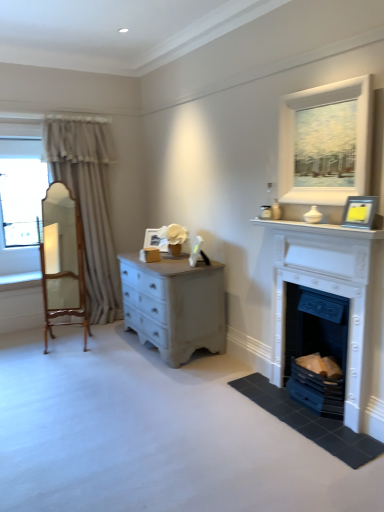
Question: Are matte white painting at upper right and white matte picture frame at center, which ranks as the 2th picture frame in right-to-left order, located far from each other?

Choices:
 (A) yes
 (B) no

Answer: (A)

Question: Can you see matte white painting at upper right touching white matte picture frame at center, which is the 1th picture frame from left to right?

Choices:
 (A) yes
 (B) no

Answer: (B)

Question: From the image's perspective, is matte white painting at upper right located beneath white matte picture frame at center, which is the 1th picture frame from left to right?

Choices:
 (A) no
 (B) yes

Answer: (A)

Question: Is matte white painting at upper right positioned with its back to white matte picture frame at center, which is the 1th picture frame from left to right?

Choices:
 (A) no
 (B) yes

Answer: (A)

Question: Considering the relative positions of matte white painting at upper right and white matte picture frame at center, which is the 1th picture frame from left to right, in the image provided, is matte white painting at upper right behind white matte picture frame at center, which is the 1th picture frame from left to right,?

Choices:
 (A) yes
 (B) no

Answer: (B)

Question: Is matte white painting at upper right closer to the viewer compared to white matte picture frame at center, which is the second picture frame from front to back?

Choices:
 (A) yes
 (B) no

Answer: (A)

Question: Is white matte picture frame at center, which ranks as the 2th picture frame in right-to-left order, taller than silver metallic picture frame at upper right, the second picture frame positioned from the back?

Choices:
 (A) yes
 (B) no

Answer: (A)

Question: From a real-world perspective, is white matte picture frame at center, which ranks as the 2th picture frame in right-to-left order, on top of silver metallic picture frame at upper right, arranged as the first picture frame when viewed from the right?

Choices:
 (A) no
 (B) yes

Answer: (A)

Question: Would you consider white matte picture frame at center, which ranks as the 2th picture frame in right-to-left order, to be distant from silver metallic picture frame at upper right, the second picture frame positioned from the back?

Choices:
 (A) no
 (B) yes

Answer: (B)

Question: Considering the relative positions of white matte picture frame at center, which is the 1th picture frame from left to right, and silver metallic picture frame at upper right, the second picture frame positioned from the back, in the image provided, is white matte picture frame at center, which is the 1th picture frame from left to right, behind silver metallic picture frame at upper right, the second picture frame positioned from the back,?

Choices:
 (A) yes
 (B) no

Answer: (A)

Question: Does white matte picture frame at center, which ranks as the 2th picture frame in right-to-left order, lie in front of silver metallic picture frame at upper right, which ranks as the 1th picture frame in front-to-back order?

Choices:
 (A) yes
 (B) no

Answer: (B)

Question: Considering the relative positions of white matte picture frame at center, which is the second picture frame from front to back, and silver metallic picture frame at upper right, the second picture frame positioned from the back, in the image provided, is white matte picture frame at center, which is the second picture frame from front to back, to the left of silver metallic picture frame at upper right, the second picture frame positioned from the back, from the viewer's perspective?

Choices:
 (A) yes
 (B) no

Answer: (A)

Question: Is white glossy mantle at upper right shorter than beige fabric curtain at left?

Choices:
 (A) no
 (B) yes

Answer: (B)